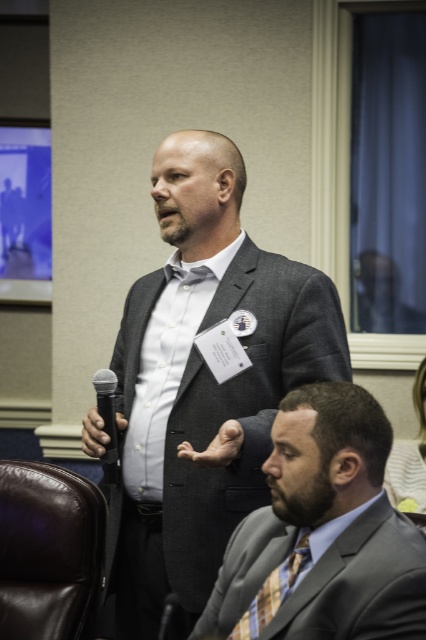
You are organizing a small event and need to place a 1.2 meter wide table between the brown leather chair at lower left and the black matte microphone at left. Will the table fit between them?

The brown leather chair at lower left is larger in size than the black matte microphone at left, but the description does not provide specific distance between them. Therefore, it is impossible to determine if the table will fit.

You are an event organizer setting up a stage for a presentation. You have a brown leather chair at lower left and a black matte microphone at left. Where should you place the microphone relative to the chair to ensure the presenter can reach it comfortably while sitting?

The black matte microphone at left should be placed in front of the brown leather chair at lower left instead of behind it, as the current setup has the microphone behind the chair, which would make it difficult for the presenter to reach comfortably while sitting.

You are an event organizer setting up a seating arrangement. You need to place a podium for the standing man and a chair for the seated man. Based on the position of the matte gray suit at center, where should you place the podium and chair in relation to each other?

The podium should be placed behind the matte gray suit at center at position point (204, 381), and the chair should be positioned slightly in front of it, maintaining the existing spatial relationship between the standing and seated men.